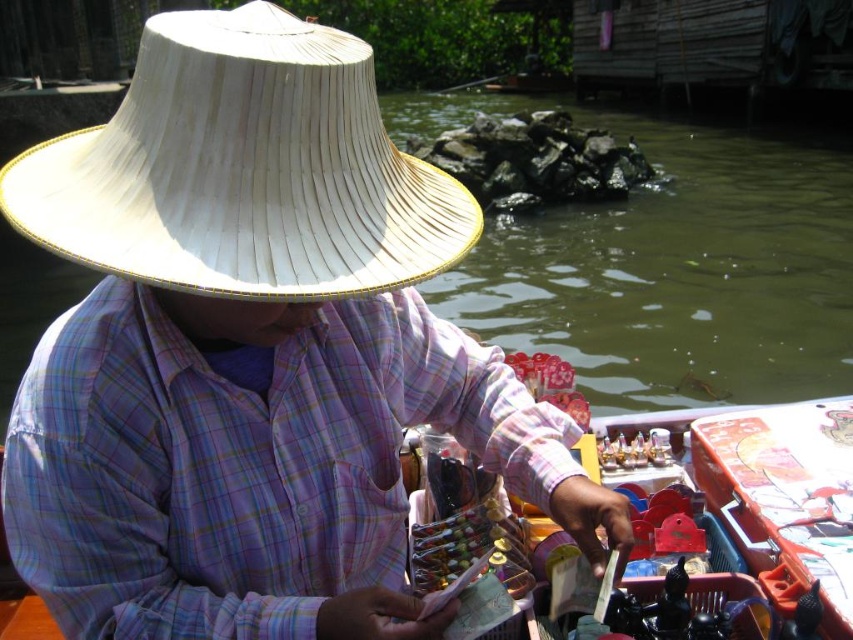
Is plaid fabric at center to the right of white woven straw hat at upper center from the viewer's perspective?

Correct, you'll find plaid fabric at center to the right of white woven straw hat at upper center.

Does plaid fabric at center have a greater width compared to white woven straw hat at upper center?

Yes, plaid fabric at center is wider than white woven straw hat at upper center.

Does point (256, 609) lie in front of point (281, 124)?

No, (256, 609) is further to viewer.

Image resolution: width=853 pixels, height=640 pixels. In order to click on plaid fabric at center in this screenshot , I will do `click(242, 464)`.